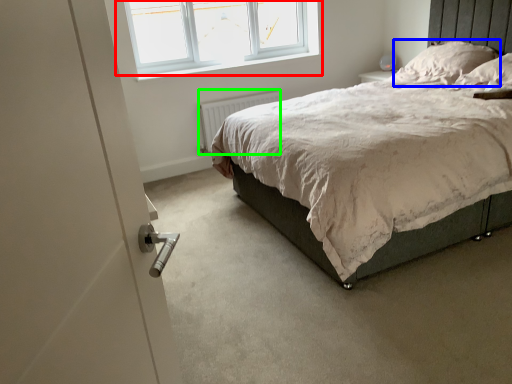
Question: Based on their relative distances, which object is nearer to window (highlighted by a red box)? Choose from pillow (highlighted by a blue box) and radiator (highlighted by a green box).

Choices:
 (A) pillow
 (B) radiator

Answer: (B)